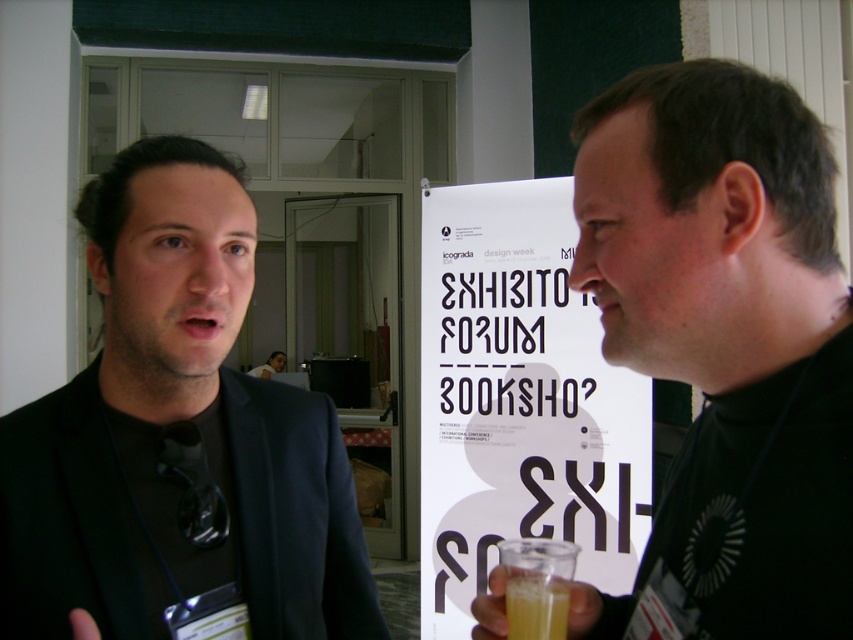
You are standing in the room and want to place a small plant between the two points, point (525,484) and point (260,372). Which point should the plant be closer to in order to be nearer to the foreground of the image?

The plant should be placed closer to point (525,484) because it is closer to the camera than point (260,372), making it part of the foreground.

You are standing at the point marked as point (535, 604) and want to walk towards the person on the right. Is there an obstacle in your path?

At point (535, 604) lies translucent glass at lower center, so yes, there is an obstacle in your path towards the person on the right.

You are standing at the center of the room and need to hand a document to the person wearing the black turtleneck sweater at right. Based on the coordinates provided, in which direction should you move to reach them?

The black turtleneck sweater at right is located at coordinates point (724, 344). Since you are at the center, moving towards the right and slightly upwards would lead you to the black turtleneck sweater at right.